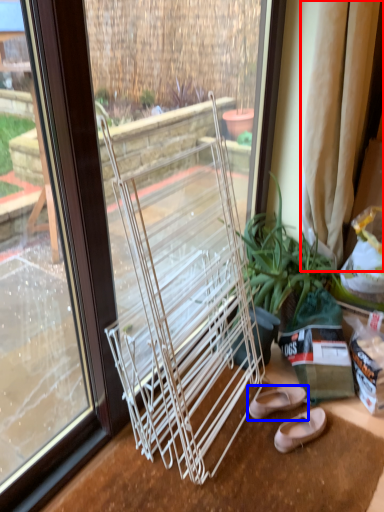
Question: Which object is closer to the camera taking this photo, curtain (highlighted by a red box) or footwear (highlighted by a blue box)?

Choices:
 (A) curtain
 (B) footwear

Answer: (A)